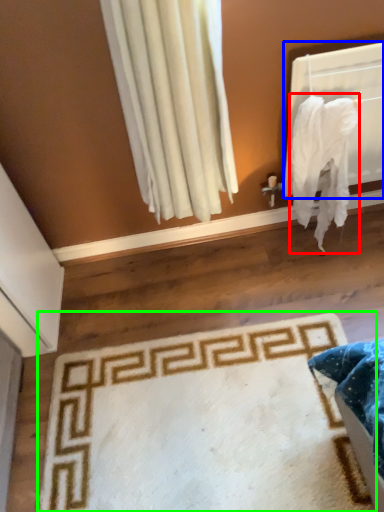
Question: Considering the real-world distances, which object is farthest from blanket (highlighted by a red box)? window screen (highlighted by a blue box) or mat (highlighted by a green box)?

Choices:
 (A) window screen
 (B) mat

Answer: (B)